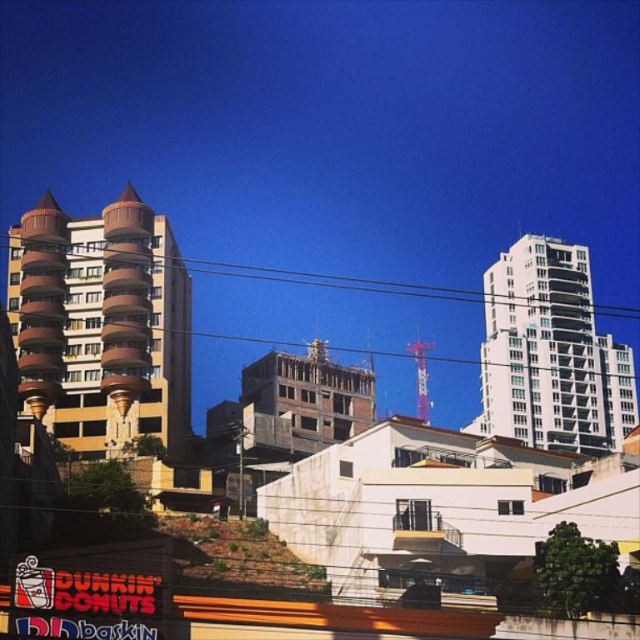
Question: Is white glass building at upper right to the right of black wire at upper center from the viewer's perspective?

Choices:
 (A) yes
 (B) no

Answer: (A)

Question: Which point is closer to the camera?

Choices:
 (A) (176, 337)
 (B) (369, 280)
 (C) (570, 380)

Answer: (A)

Question: Is white glass building at upper right wider than black wire at upper center?

Choices:
 (A) no
 (B) yes

Answer: (A)

Question: Which of the following is the closest to the observer?

Choices:
 (A) brown textured building at center-left
 (B) black wire at upper center

Answer: (A)

Question: Based on their relative distances, which object is farther from the black wire at upper center?

Choices:
 (A) white glass building at upper right
 (B) brown textured building at center-left

Answer: (B)

Question: Does brown textured building at center-left have a larger size compared to black wire at upper center?

Choices:
 (A) yes
 (B) no

Answer: (B)